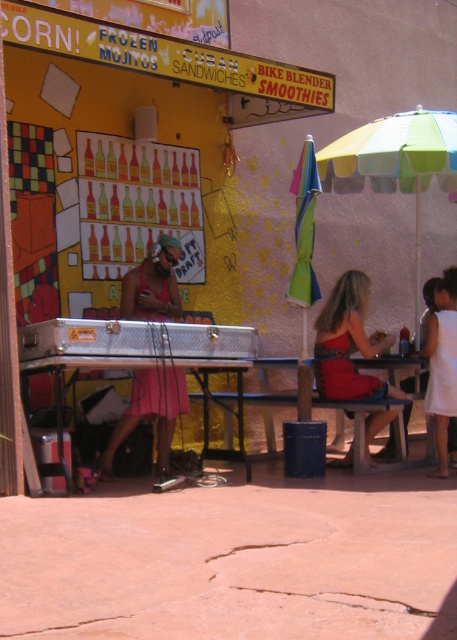
You are a customer at the food stand and want to place an order. You see the white cotton dress at lower right and the wooden table at lower center. Which object is narrower?

The white cotton dress at lower right is narrower than the wooden table at lower center.